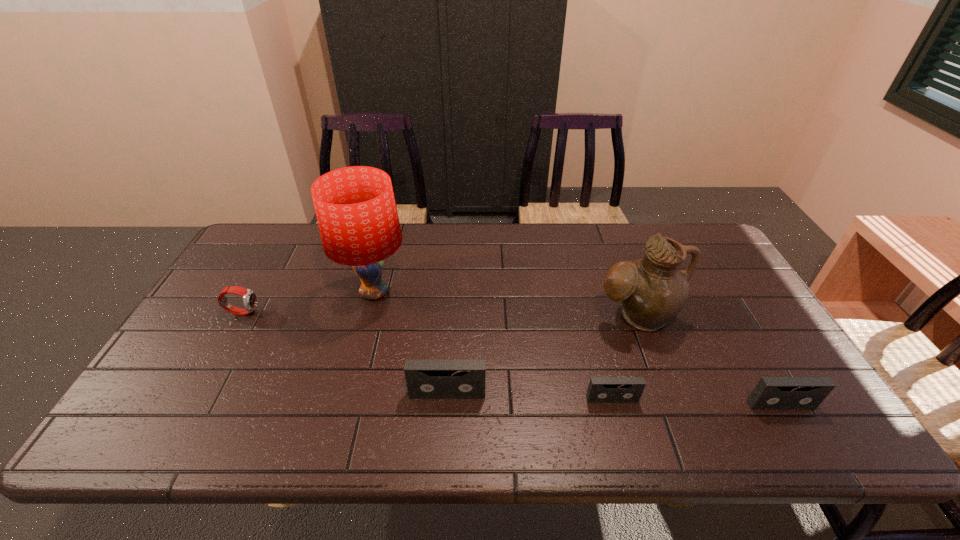
The height and width of the screenshot is (540, 960). I want to click on free spot between the leftmost object and the shortest videotape, so click(x=427, y=355).

Identify which object is the second nearest to the pitcher. Please provide its 2D coordinates. Your answer should be formatted as a tuple, i.e. [(x, y)], where the tuple contains the x and y coordinates of a point satisfying the conditions above.

[(771, 393)]

Where is `the fourth closest object to the leftmost object`? The image size is (960, 540). the fourth closest object to the leftmost object is located at coordinates point(652,290).

At what (x,y) coordinates should I click in order to perform the action: click on videotape object that ranks as the third closest to the watch. Please return your answer as a coordinate pair (x, y). The height and width of the screenshot is (540, 960). Looking at the image, I should click on (771, 393).

Find the location of a particular element. videotape object that ranks as the closest to the fourth object from right to left is located at coordinates (601, 389).